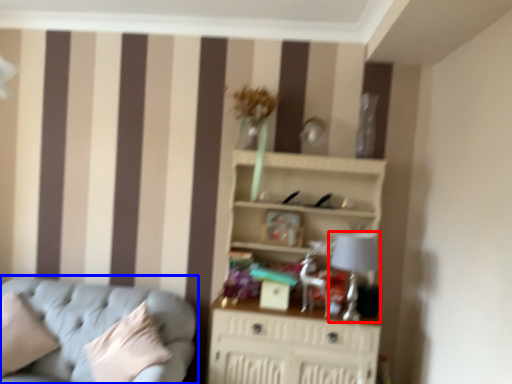
Question: Which point is further to the camera, table lamp (highlighted by a red box) or studio couch (highlighted by a blue box)?

Choices:
 (A) table lamp
 (B) studio couch

Answer: (A)